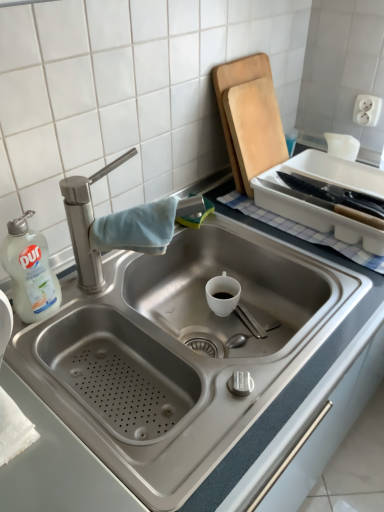
Question: Should I look upward or downward to see white plastic bottle at left?

Choices:
 (A) up
 (B) down

Answer: (B)

Question: Considering the relative positions of wooden cutting board at upper right and stainless steel sink at center in the image provided, is wooden cutting board at upper right to the right of stainless steel sink at center from the viewer's perspective?

Choices:
 (A) yes
 (B) no

Answer: (A)

Question: Is stainless steel sink at center at the back of wooden cutting board at upper right?

Choices:
 (A) yes
 (B) no

Answer: (B)

Question: Is wooden cutting board at upper right shorter than stainless steel sink at center?

Choices:
 (A) yes
 (B) no

Answer: (B)

Question: Is wooden cutting board at upper right bigger than stainless steel sink at center?

Choices:
 (A) yes
 (B) no

Answer: (B)

Question: Are wooden cutting board at upper right and stainless steel sink at center beside each other?

Choices:
 (A) yes
 (B) no

Answer: (B)

Question: From a real-world perspective, is wooden cutting board at upper right beneath stainless steel sink at center?

Choices:
 (A) no
 (B) yes

Answer: (A)

Question: Are white plastic bottle at left and stainless steel sink at center beside each other?

Choices:
 (A) yes
 (B) no

Answer: (B)

Question: Is white plastic bottle at left shorter than stainless steel sink at center?

Choices:
 (A) yes
 (B) no

Answer: (A)

Question: Is stainless steel sink at center at the back of white plastic bottle at left?

Choices:
 (A) no
 (B) yes

Answer: (A)

Question: Is the position of white plastic bottle at left less distant than that of stainless steel sink at center?

Choices:
 (A) no
 (B) yes

Answer: (A)

Question: Considering the relative sizes of white plastic bottle at left and stainless steel sink at center in the image provided, is white plastic bottle at left smaller than stainless steel sink at center?

Choices:
 (A) no
 (B) yes

Answer: (B)

Question: Is white plastic bottle at left taller than stainless steel sink at center?

Choices:
 (A) no
 (B) yes

Answer: (A)

Question: From a real-world perspective, is wooden cutting board at upper right beneath white plastic bottle at left?

Choices:
 (A) no
 (B) yes

Answer: (A)